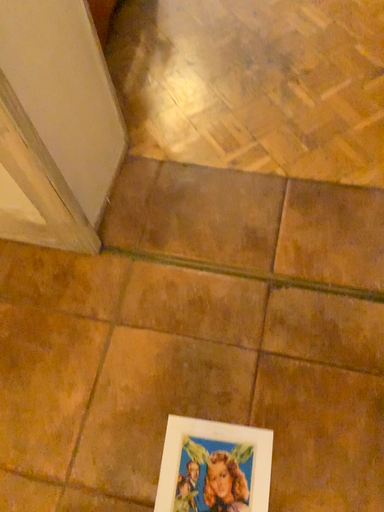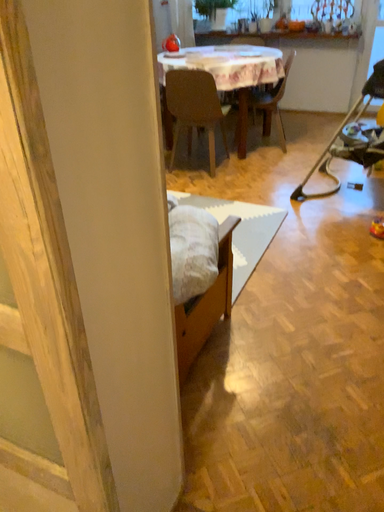
Question: Which way did the camera rotate in the video?

Choices:
 (A) rotated upward
 (B) rotated downward

Answer: (A)